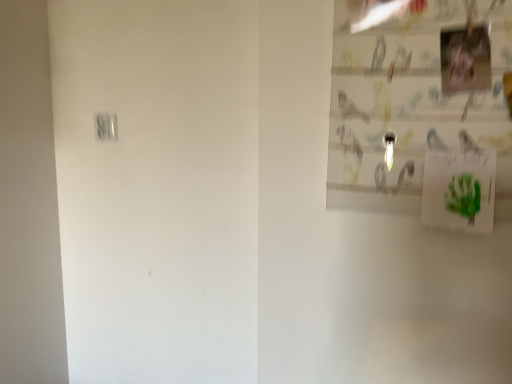
Question: Would you say green paper postcard at upper right is to the left or to the right of white plastic light switch at upper left in the picture?

Choices:
 (A) right
 (B) left

Answer: (A)

Question: From a real-world perspective, is green paper postcard at upper right positioned above or below white plastic light switch at upper left?

Choices:
 (A) above
 (B) below

Answer: (B)

Question: From their relative heights in the image, would you say green paper postcard at upper right is taller or shorter than white plastic light switch at upper left?

Choices:
 (A) tall
 (B) short

Answer: (A)

Question: In the image, is white plastic light switch at upper left on the left side or the right side of green paper postcard at upper right?

Choices:
 (A) right
 (B) left

Answer: (B)

Question: Is white plastic light switch at upper left in front of or behind green paper postcard at upper right in the image?

Choices:
 (A) behind
 (B) front

Answer: (A)

Question: Looking at their shapes, would you say white plastic light switch at upper left is wider or thinner than green paper postcard at upper right?

Choices:
 (A) wide
 (B) thin

Answer: (B)

Question: Do you think white plastic light switch at upper left is within green paper postcard at upper right, or outside of it?

Choices:
 (A) outside
 (B) inside

Answer: (A)